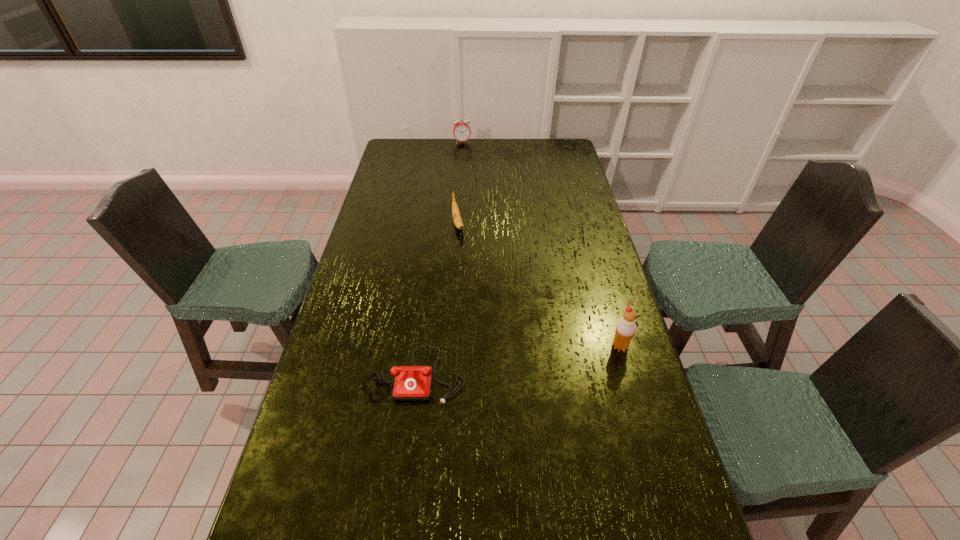
Find the location of a particular element. The height and width of the screenshot is (540, 960). free space on the desktop that is between the telephone and the tallest object and is positioned on the peel of the second farthest object from the top is located at coordinates 498,362.

Where is `vacant space on the desktop that is between the telephone and the icecream and is positioned on the front-facing side of the farthest object`? This screenshot has width=960, height=540. vacant space on the desktop that is between the telephone and the icecream and is positioned on the front-facing side of the farthest object is located at coordinates (516, 360).